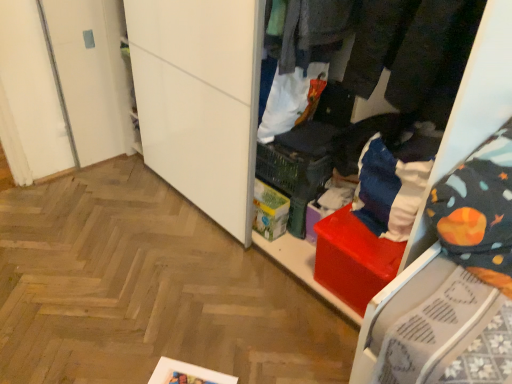
Question: Looking at their shapes, would you say white fabric bag at center, positioned as the first clothing in back-to-front order, is wider or thinner than dark gray fabric pants at upper center, which appears as the 3th clothing when viewed from the front?

Choices:
 (A) wide
 (B) thin

Answer: (B)

Question: In the image, is white fabric bag at center, positioned as the first clothing in back-to-front order, positioned in front of or behind dark gray fabric pants at upper center, which appears as the 3th clothing when viewed from the front?

Choices:
 (A) behind
 (B) front

Answer: (A)

Question: Estimate the real-world distances between objects in this image. Which object is farther from the dark gray fabric pants at center, acting as the second clothing starting from the front?

Choices:
 (A) white fabric bag at center, the 4th clothing positioned from the front
 (B) black fabric pants at upper right, acting as the 4th clothing starting from the back
 (C) dark gray fabric pants at upper center, which appears as the 3th clothing when viewed from the front
 (D) white cardboard box at center

Answer: (D)

Question: Estimate the real-world distances between objects in this image. Which object is closer to the white cardboard box at center?

Choices:
 (A) white fabric bag at center, positioned as the first clothing in back-to-front order
 (B) black fabric pants at upper right, the 1th clothing positioned from the front
 (C) dark gray fabric pants at center, arranged as the third clothing when viewed from the back
 (D) dark gray fabric pants at upper center, marked as the 2th clothing in a back-to-front arrangement

Answer: (A)